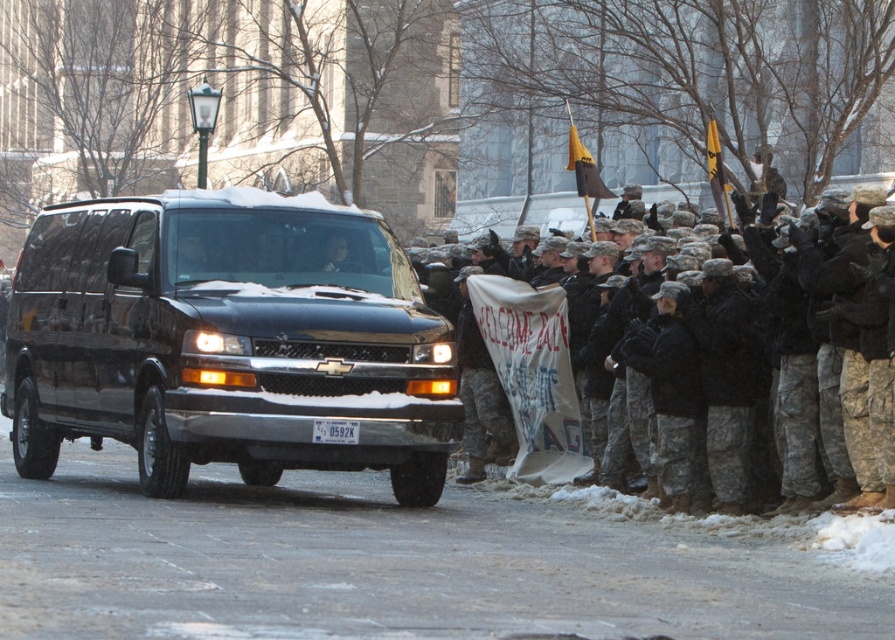
Question: Does camouflage fabric uniform at right appear over white plastic license plate at center?

Choices:
 (A) yes
 (B) no

Answer: (A)

Question: Is black matte van at center to the right of camouflage fabric uniform at right from the viewer's perspective?

Choices:
 (A) yes
 (B) no

Answer: (B)

Question: Considering the real-world distances, which object is farthest from the black matte van at center?

Choices:
 (A) white plastic license plate at center
 (B) camouflage fabric uniform at right

Answer: (B)

Question: Does black matte van at center have a lesser width compared to camouflage fabric uniform at right?

Choices:
 (A) no
 (B) yes

Answer: (A)

Question: Which object is closer to the camera taking this photo?

Choices:
 (A) white plastic license plate at center
 (B) camouflage fabric uniform at right

Answer: (B)

Question: Among these objects, which one is nearest to the camera?

Choices:
 (A) black matte van at center
 (B) camouflage fabric uniform at right
 (C) white plastic license plate at center

Answer: (B)